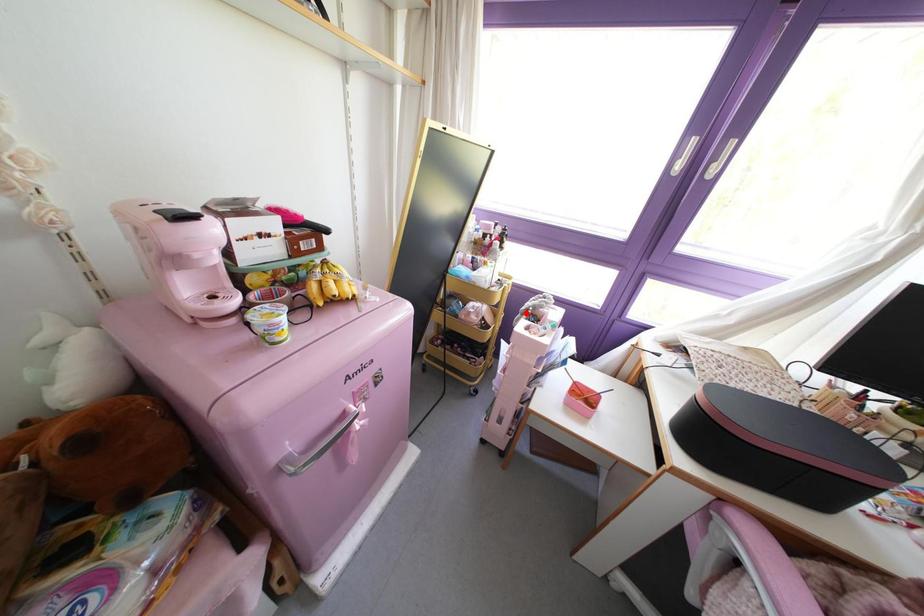
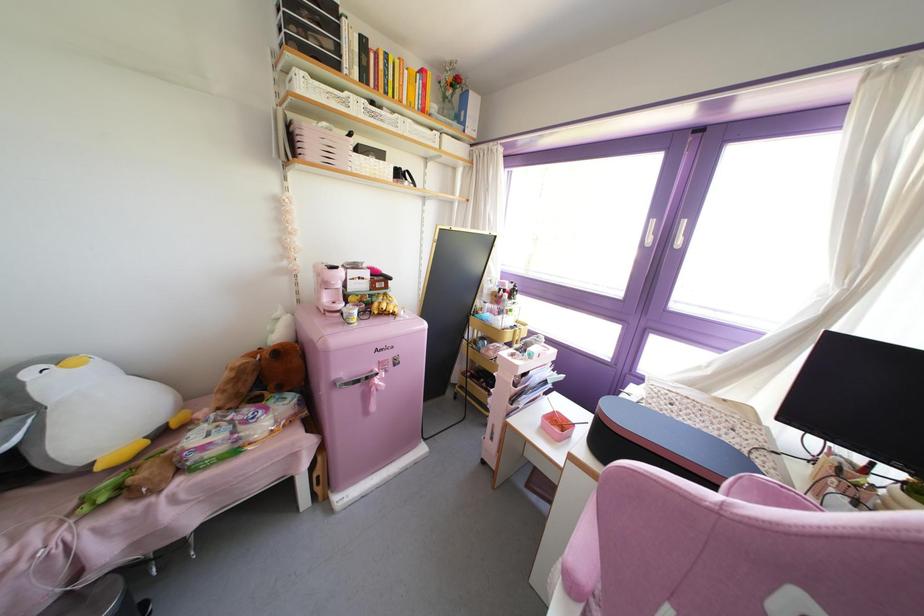
Locate, in the second image, the point that corresponds to the highlighted location in the first image.

(516, 345)